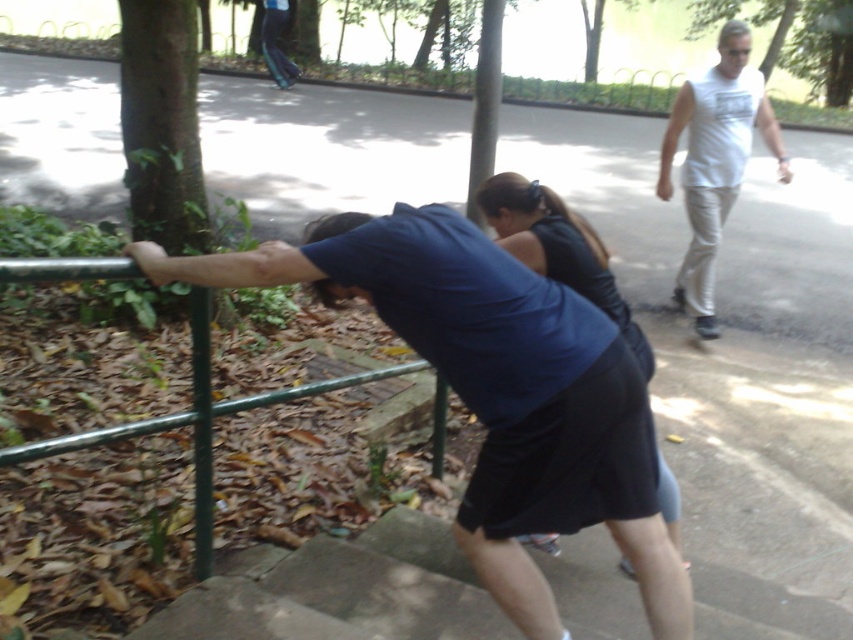
You are standing in the park and see two points marked in the scene. Which point is closer to you, point (166, 42) or point (547, 540)?

Point (166, 42) is closer to you because it is further to the viewer than point (547, 540).

You are a photographer trying to capture the person in the white cotton tank top at upper right. The camera you are using has a rectangular viewfinder with coordinates from 0 to 1 on both the x and y axes. You want to ensure the point at coordinate [715,161] is centered in the viewfinder. What adjustment should you make to the camera position?

The point at coordinate [715,161] is located on the white cotton tank top at upper right. To center this point in the viewfinder, you need to move the camera so that the point aligns with the center coordinates of the viewfinder, which is at 0.5, 0.5. Since the current x coordinate is 0.252 and y is 0.839, you should move the camera to the right and down to bring the point to the center.